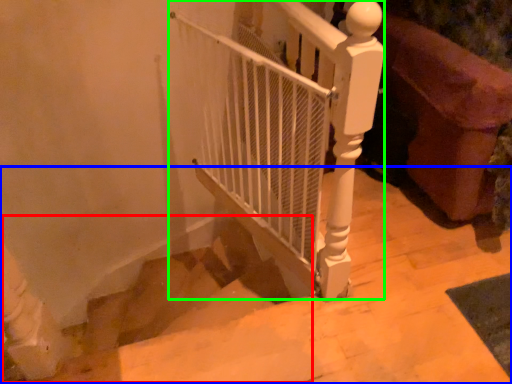
Question: Which is nearer to the stairwell (highlighted by a red box)? stairs (highlighted by a blue box) or fence (highlighted by a green box).

Choices:
 (A) stairs
 (B) fence

Answer: (A)